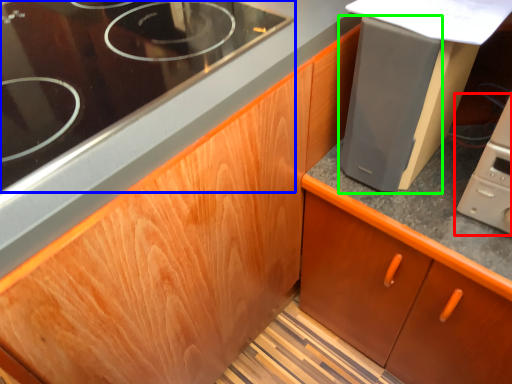
Question: Which object is the closest to the home appliance (highlighted by a red box)? Choose among these: gas stove (highlighted by a blue box) or appliance (highlighted by a green box).

Choices:
 (A) gas stove
 (B) appliance

Answer: (B)